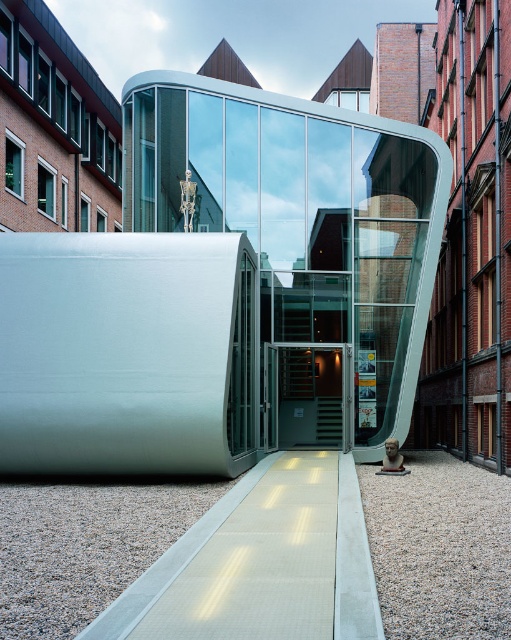
From the picture: You are standing at the entrance of the building and want to walk towards the point that is closer to you. Which point should you head towards, point (257, 492) or point (311, 442)?

Point (257, 492) is closer to the viewer than point (311, 442), so you should head towards point (257, 492).

You are an architect visiting the building and need to enter through the entrance. You see the polished glass sculpture at center and the metallic glass door at center. Which object is larger in size?

The polished glass sculpture at center is bigger than the metallic glass door at center according to the description.

You are a delivery person with a cart that is 1.2 meters wide. You need to move from the white textured walkway at center to the metallic glass door at center. Is there enough space between them for your cart to pass through?

The distance between the white textured walkway at center and the metallic glass door at center is 8.83 meters, which is more than enough space for the cart that is 1.2 meters wide to pass through.